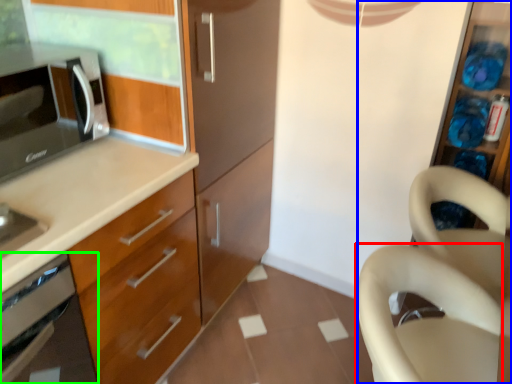
Question: Which object is the farthest from swivel chair (highlighted by a red box)? Choose among these: dresser (highlighted by a blue box) or oven (highlighted by a green box).

Choices:
 (A) dresser
 (B) oven

Answer: (B)